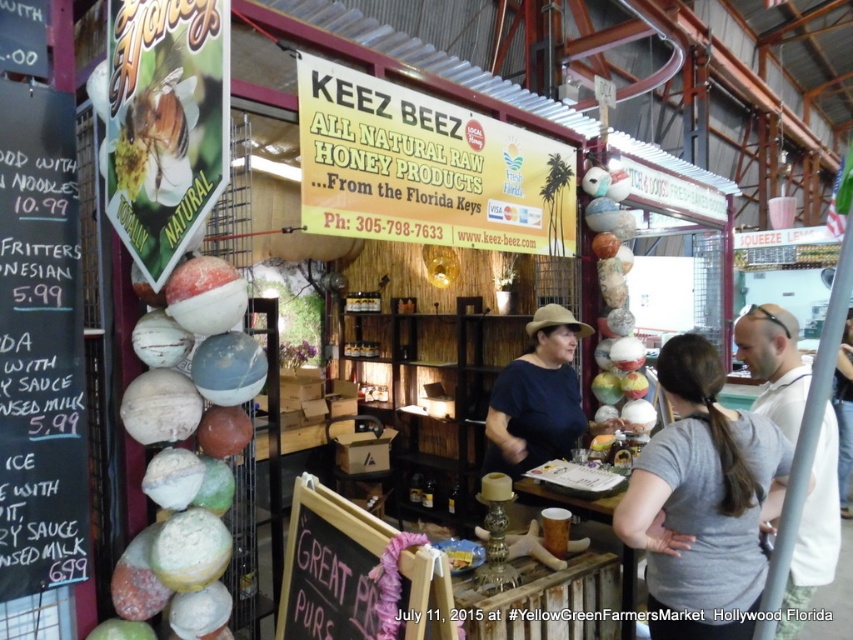
You are a customer at the KEEZ BEEZ stall and want to read the black chalkboard menu at left while also keeping an eye on your gray cotton shirt at center. Which object is narrower so you can focus on it without moving too much?

The black chalkboard menu at left has a lesser width compared to the gray cotton shirt at center, so you can focus on the black chalkboard menu at left without moving too much since it is narrower.